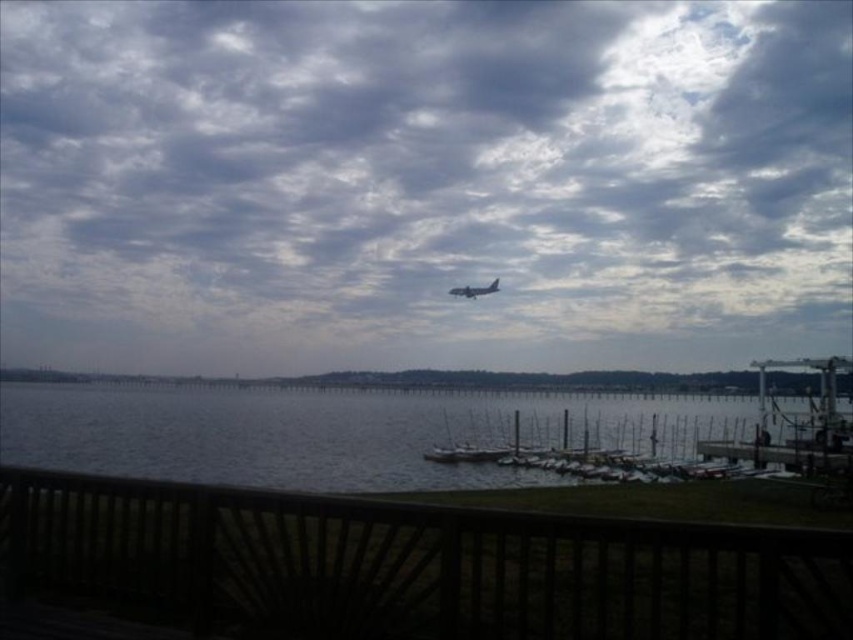
Based on the photo, measure the distance between wooden dock at lower right and metallic silver airplane at upper center.

They are 18.39 meters apart.

Who is more forward, (740,454) or (466,292)?

Point (740,454)

Describe the element at coordinates (776, 456) in the screenshot. I see `wooden dock at lower right` at that location.

I want to click on wooden dock at lower right, so click(x=776, y=456).

Which is behind, point (665, 67) or point (447, 292)?

The point (665, 67) is behind.

Who is positioned more to the left, cloudy sky at upper center or metallic silver airplane at upper center?

From the viewer's perspective, cloudy sky at upper center appears more on the left side.

What do you see at coordinates (422, 182) in the screenshot? This screenshot has width=853, height=640. I see `cloudy sky at upper center` at bounding box center [422, 182].

Locate an element on the screen. The image size is (853, 640). cloudy sky at upper center is located at coordinates (422, 182).

Who is positioned more to the right, gray water at lower center or wooden dock at lower right?

From the viewer's perspective, wooden dock at lower right appears more on the right side.

Is point (436, 392) more distant than point (811, 464)?

Yes, point (436, 392) is behind point (811, 464).

What are the coordinates of `gray water at lower center` in the screenshot? It's located at (332, 432).